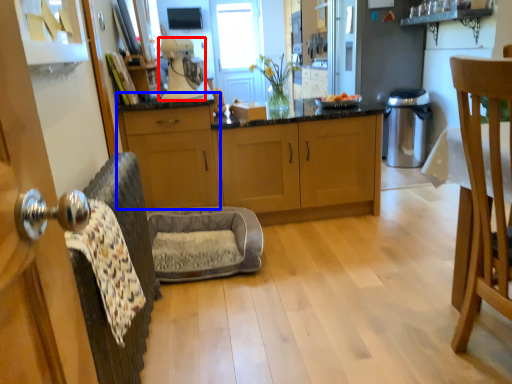
Question: Among these objects, which one is farthest to the camera, coffee machine (highlighted by a red box) or cabinetry (highlighted by a blue box)?

Choices:
 (A) coffee machine
 (B) cabinetry

Answer: (B)